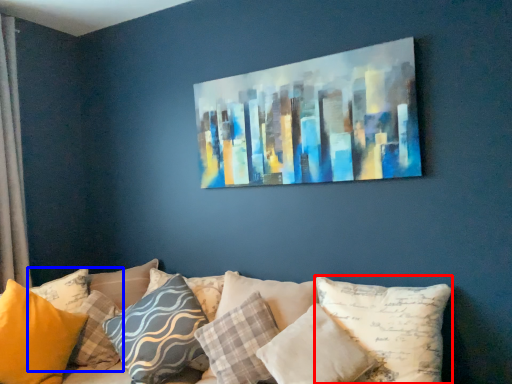
Question: Which object is further to the camera taking this photo, pillow (highlighted by a red box) or pillow (highlighted by a blue box)?

Choices:
 (A) pillow
 (B) pillow

Answer: (B)